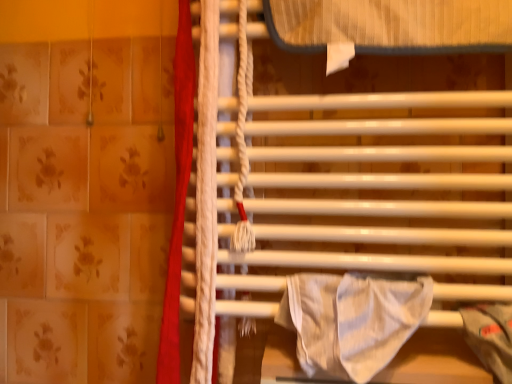
What are the coordinates of `white striped fabric at center` in the screenshot? It's located at (352, 320).

The image size is (512, 384). In order to click on white glossy towel rack at center in this screenshot , I will do `click(371, 191)`.

Is white glossy towel rack at center spatially inside red fabric curtain at left, or outside of it?

white glossy towel rack at center is not enclosed by red fabric curtain at left.

Can you tell me how much white glossy towel rack at center and red fabric curtain at left differ in facing direction?

white glossy towel rack at center and red fabric curtain at left are facing 0.000286 degrees away from each other.

Which object is wider, white glossy towel rack at center or red fabric curtain at left?

white glossy towel rack at center is wider.

Which object is more forward, white glossy towel rack at center or red fabric curtain at left?

Positioned in front is white glossy towel rack at center.

From the image's perspective, who appears lower, white striped fabric at center or white glossy towel rack at center?

white striped fabric at center.

Between point (364, 287) and point (281, 222), which one is positioned in front?

The point (364, 287) is in front.

Is white striped fabric at center located outside white glossy towel rack at center?

Yes.

Looking at their sizes, would you say white striped fabric at center is wider or thinner than white glossy towel rack at center?

Considering their sizes, white striped fabric at center looks slimmer than white glossy towel rack at center.

Considering the positions of objects white striped fabric at center and red fabric curtain at left in the image provided, who is more to the right, white striped fabric at center or red fabric curtain at left?

From the viewer's perspective, white striped fabric at center appears more on the right side.

Is white striped fabric at center facing away from red fabric curtain at left?

No, red fabric curtain at left is not at the back of white striped fabric at center.

Is white striped fabric at center next to red fabric curtain at left?

They are not placed beside each other.

Is white striped fabric at center wider or thinner than red fabric curtain at left?

Clearly, white striped fabric at center has less width compared to red fabric curtain at left.

From their relative heights in the image, would you say white glossy towel rack at center is taller or shorter than white striped fabric at center?

Clearly, white glossy towel rack at center is taller compared to white striped fabric at center.

Considering the sizes of objects white glossy towel rack at center and white striped fabric at center in the image provided, who is wider, white glossy towel rack at center or white striped fabric at center?

Wider between the two is white glossy towel rack at center.

Are white glossy towel rack at center and white striped fabric at center far apart?

No, white glossy towel rack at center is not far from white striped fabric at center.

Looking at the image, does white glossy towel rack at center seem bigger or smaller compared to white striped fabric at center?

white glossy towel rack at center is bigger than white striped fabric at center.

Who is smaller, red fabric curtain at left or white striped fabric at center?

With smaller size is white striped fabric at center.

Is red fabric curtain at left oriented away from white striped fabric at center?

No, white striped fabric at center is not at the back of red fabric curtain at left.

From the image's perspective, which one is positioned higher, red fabric curtain at left or white striped fabric at center?

red fabric curtain at left, from the image's perspective.

This screenshot has height=384, width=512. Identify the location of curtain above the white striped fabric at center (from the image's perspective). (178, 195).

Does red fabric curtain at left have a smaller size compared to white glossy towel rack at center?

Yes.

From a real-world perspective, who is located higher, red fabric curtain at left or white glossy towel rack at center?

From a 3D spatial view, white glossy towel rack at center is above.

Can you confirm if red fabric curtain at left is thinner than white glossy towel rack at center?

Yes, red fabric curtain at left is thinner than white glossy towel rack at center.

Is point (163, 307) closer or farther from the camera than point (228, 307)?

Point (163, 307).

This screenshot has height=384, width=512. I want to click on curtain that is on the left side of white glossy towel rack at center, so click(178, 195).

Image resolution: width=512 pixels, height=384 pixels. In order to click on blanket below the white glossy towel rack at center (from a real-world perspective) in this screenshot , I will do `click(352, 320)`.

Estimate the real-world distances between objects in this image. Which object is closer to white striped fabric at center, white glossy towel rack at center or red fabric curtain at left?

white glossy towel rack at center.

Based on their spatial positions, is white striped fabric at center or white glossy towel rack at center further from red fabric curtain at left?

The object further to red fabric curtain at left is white striped fabric at center.

Considering their positions, is white striped fabric at center positioned closer to white glossy towel rack at center than red fabric curtain at left?

white striped fabric at center lies closer to white glossy towel rack at center than the other object.

Estimate the real-world distances between objects in this image. Which object is further from white glossy towel rack at center, red fabric curtain at left or white striped fabric at center?

Based on the image, red fabric curtain at left appears to be further to white glossy towel rack at center.

Estimate the real-world distances between objects in this image. Which object is further from white striped fabric at center, red fabric curtain at left or white glossy towel rack at center?

The object further to white striped fabric at center is red fabric curtain at left.

Which object lies nearer to the anchor point red fabric curtain at left, white glossy towel rack at center or white striped fabric at center?

Among the two, white glossy towel rack at center is located nearer to red fabric curtain at left.

Identify the location of blanket situated between red fabric curtain at left and white glossy towel rack at center from left to right. (352, 320).